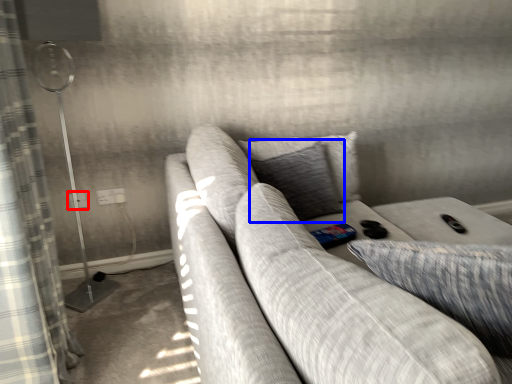
Question: Which point is closer to the camera, electric outlet (highlighted by a red box) or pillow (highlighted by a blue box)?

Choices:
 (A) electric outlet
 (B) pillow

Answer: (B)